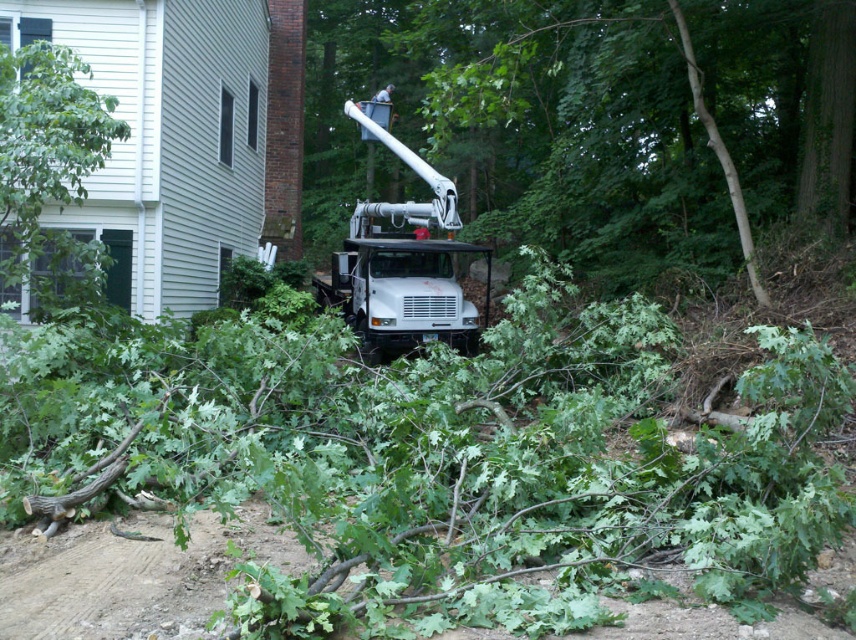
You are standing at the point marked as point (596, 120). What is the nearest object to you in the scene?

The nearest object to point (596, 120) is the green leafy tree at center, as the point is located on it.

You are standing at the viewpoint of the image and see two points marked in the scene. Which point is closer to you, point (767, 128) or point (412, 234)?

Point (767, 128) is closer to you because it is in front of point (412, 234).

You are a worker standing next to the green leafy tree at left and the white metallic bucket truck at center. You need to choose which one to move first. Which one is easier to move? Explain why based on their sizes.

The green leafy tree at left is easier to move because it is thinner than the white metallic bucket truck at center, making it more maneuverable.